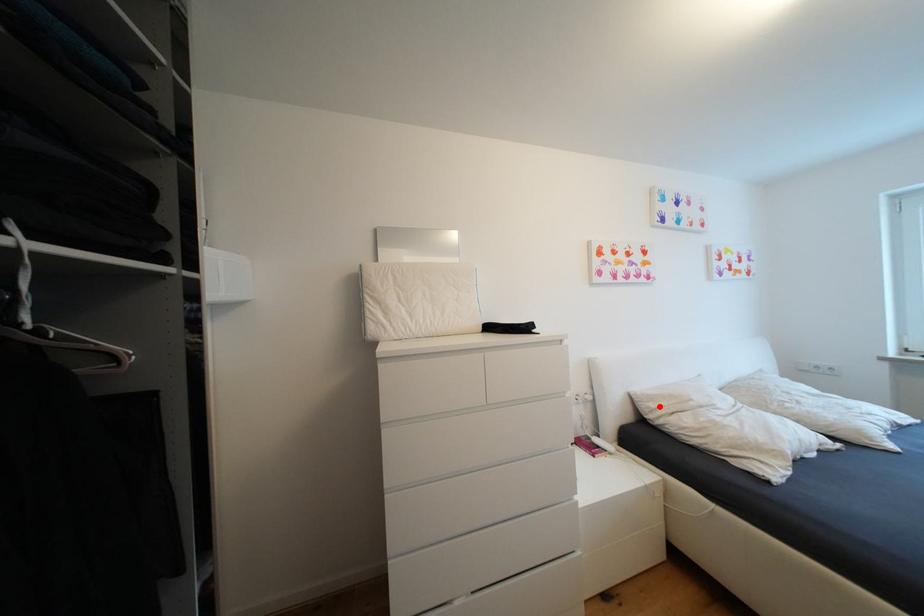
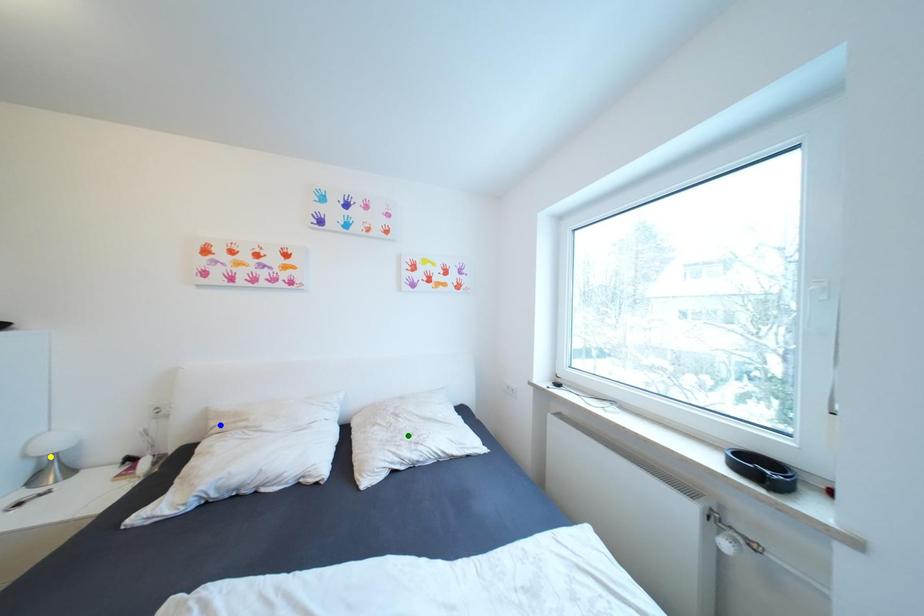
Question: I am providing you with two images of the same scene from different viewpoints. A red point is marked on the first image. You are given multiple points on the second image. Which point in image 2 is actually the same real-world point as the red point in image 1?

Choices:
 (A) yellow point
 (B) green point
 (C) blue point

Answer: (C)